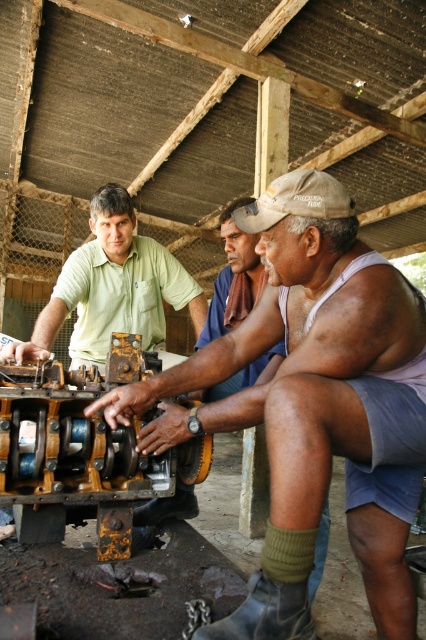
Looking at this image, you are a visitor in the workshop and want to know which object is bigger between the matte black machine at center and the brown fabric shirt at center. Can you tell me?

The matte black machine at center is larger in size compared to the brown fabric shirt at center.

You are a technician trying to reach the matte black machine at center while wearing the brown fabric shirt at center. Can you comfortably access the machine without moving the shirt?

The matte black machine at center and brown fabric shirt at center are 17.57 inches apart, so yes, you can comfortably access the matte black machine at center without moving the brown fabric shirt at center as the distance allows sufficient space.